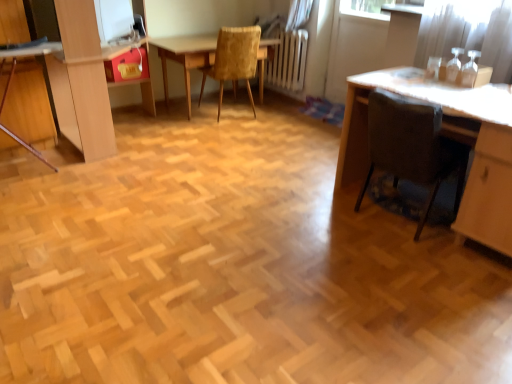
Question: Is matte red drawer at upper left located within brown fabric chair at lower right, acting as the first chair starting from the right?

Choices:
 (A) no
 (B) yes

Answer: (A)

Question: From a real-world perspective, is brown fabric chair at lower right, which is the 2th chair from back to front, positioned over matte red drawer at upper left based on gravity?

Choices:
 (A) no
 (B) yes

Answer: (A)

Question: From a real-world perspective, is brown fabric chair at lower right, which is the 2th chair from back to front, physically below matte red drawer at upper left?

Choices:
 (A) yes
 (B) no

Answer: (A)

Question: Can you confirm if brown fabric chair at lower right, acting as the first chair starting from the bottom, is positioned to the left of matte red drawer at upper left?

Choices:
 (A) yes
 (B) no

Answer: (B)

Question: Is brown fabric chair at lower right, acting as the first chair starting from the right, further to the viewer compared to matte red drawer at upper left?

Choices:
 (A) yes
 (B) no

Answer: (B)

Question: In the image, is transparent glass screen door at upper right positioned in front of or behind wooden table at center?

Choices:
 (A) front
 (B) behind

Answer: (A)

Question: From a real-world perspective, is transparent glass screen door at upper right above or below wooden table at center?

Choices:
 (A) above
 (B) below

Answer: (A)

Question: Is point (354, 23) closer or farther from the camera than point (164, 96)?

Choices:
 (A) closer
 (B) farther

Answer: (A)

Question: In terms of size, does transparent glass screen door at upper right appear bigger or smaller than wooden table at center?

Choices:
 (A) small
 (B) big

Answer: (A)

Question: Is point pos(467,145) closer or farther from the camera than point pos(355,64)?

Choices:
 (A) farther
 (B) closer

Answer: (B)

Question: Considering the relative positions of brown fabric chair at lower right, the second chair viewed from the left, and transparent glass screen door at upper right in the image provided, is brown fabric chair at lower right, the second chair viewed from the left, to the left or to the right of transparent glass screen door at upper right?

Choices:
 (A) left
 (B) right

Answer: (A)

Question: Looking at their shapes, would you say brown fabric chair at lower right, the second chair in the top-to-bottom sequence, is wider or thinner than transparent glass screen door at upper right?

Choices:
 (A) thin
 (B) wide

Answer: (B)

Question: From a real-world perspective, is brown fabric chair at lower right, which is the 2th chair from back to front, physically located above or below transparent glass screen door at upper right?

Choices:
 (A) below
 (B) above

Answer: (A)

Question: From a real-world perspective, is wooden table at center above or below matte wooden dresser at left?

Choices:
 (A) above
 (B) below

Answer: (B)

Question: Considering their positions, is wooden table at center located in front of or behind matte wooden dresser at left?

Choices:
 (A) front
 (B) behind

Answer: (B)